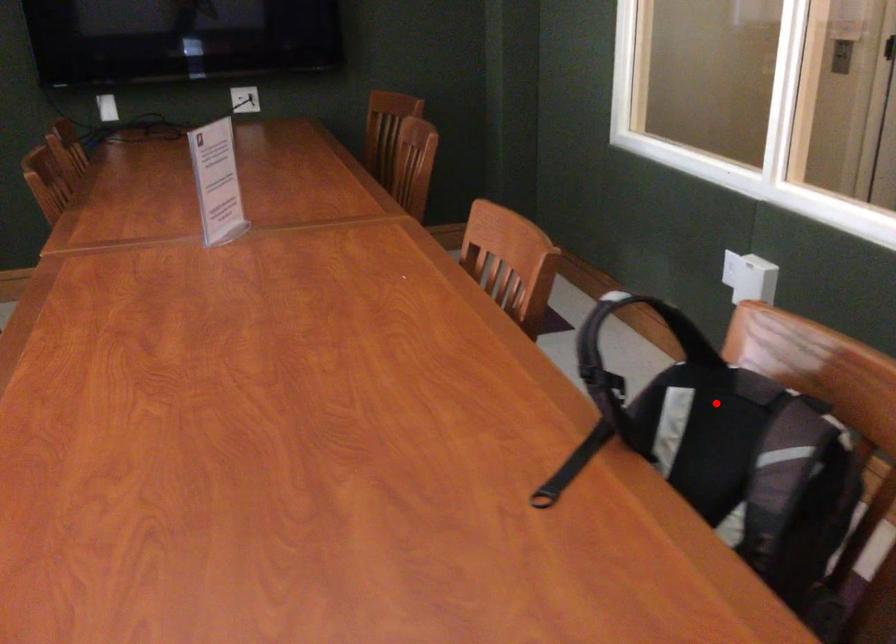
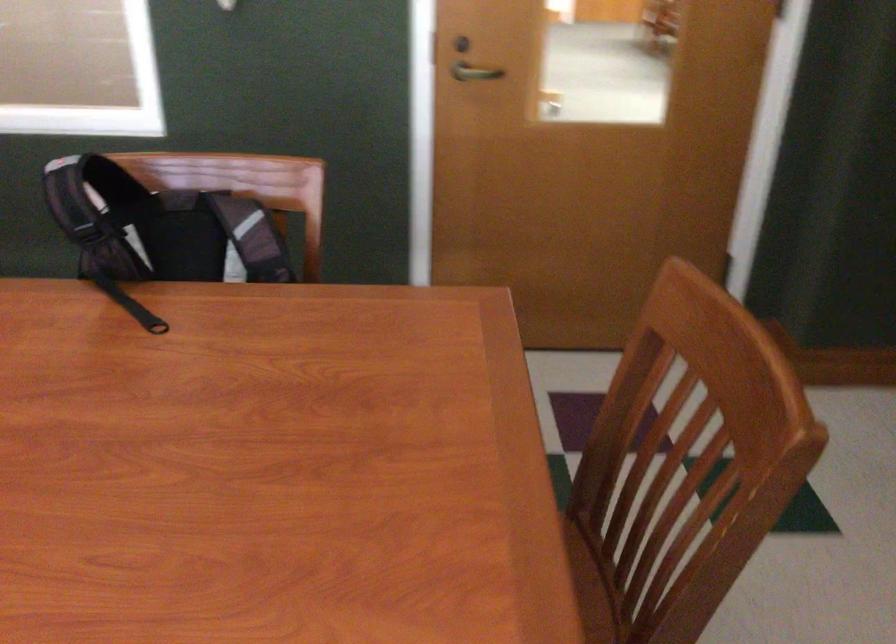
Question: I am providing you with two images of the same scene from different viewpoints. A red point is shown in image1. For the corresponding object point in image2, is it positioned nearer or farther from the camera?

Choices:
 (A) Nearer
 (B) Farther

Answer: (B)